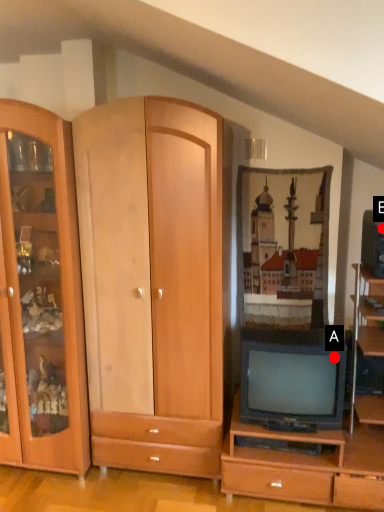
Question: Two points are circled on the image, labeled by A and B beside each circle. Which point is closer to the camera taking this photo?

Choices:
 (A) A is closer
 (B) B is closer

Answer: (A)